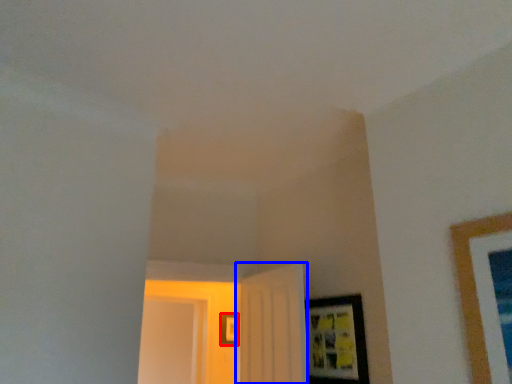
Question: Among these objects, which one is farthest to the camera, picture frame (highlighted by a red box) or door (highlighted by a blue box)?

Choices:
 (A) picture frame
 (B) door

Answer: (A)